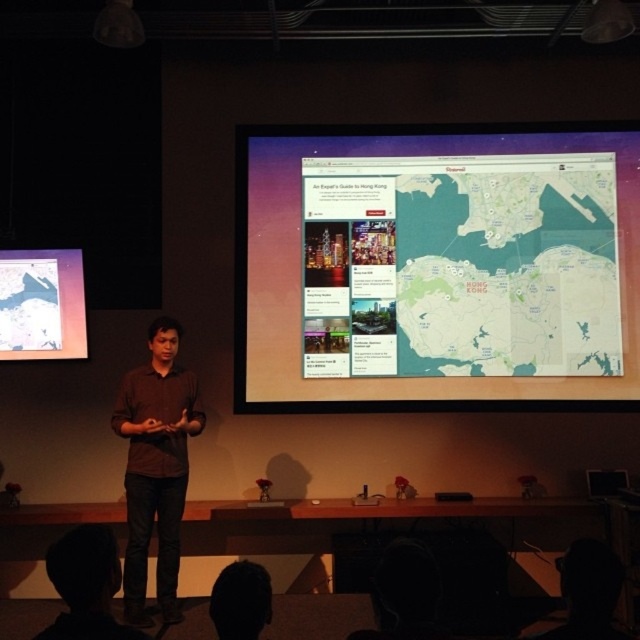
Is dark brown shirt at center below dark brown hair at lower center?

Correct, dark brown shirt at center is located below dark brown hair at lower center.

Does dark brown shirt at center appear on the right side of dark brown hair at lower center?

Incorrect, dark brown shirt at center is not on the right side of dark brown hair at lower center.

Identify the location of dark brown shirt at center. The image size is (640, 640). (86, 586).

Does white glossy map at upper left appear under dark brown hair at lower center?

Actually, white glossy map at upper left is above dark brown hair at lower center.

In order to click on white glossy map at upper left in this screenshot , I will do `click(42, 305)`.

Identify the location of white glossy map at upper left. (42, 305).

Measure the distance from matte white map at center to brown shirt at center.

The distance of matte white map at center from brown shirt at center is 5.06 feet.

Is point (516, 316) positioned behind point (147, 396)?

Yes, it is behind point (147, 396).

Where is `matte white map at center`? matte white map at center is located at coordinates (436, 268).